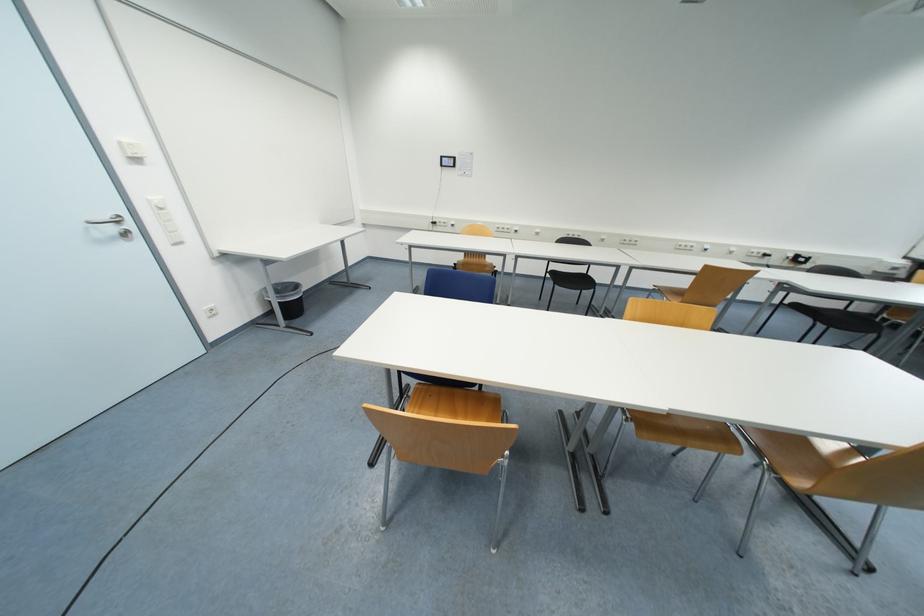
Where is `black trash can`? The height and width of the screenshot is (616, 924). black trash can is located at coordinates (286, 299).